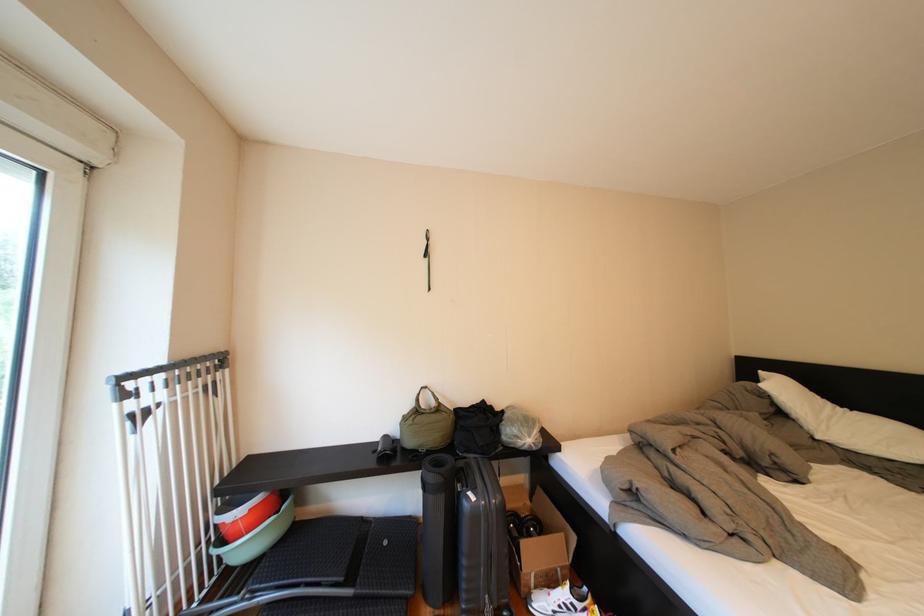
Image resolution: width=924 pixels, height=616 pixels. What do you see at coordinates (171, 476) in the screenshot?
I see `the roller shutter cord` at bounding box center [171, 476].